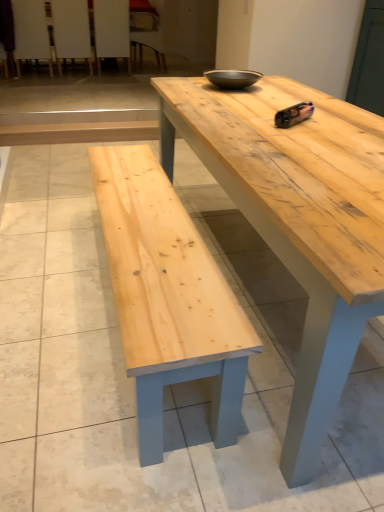
Find the location of a particular element. Image resolution: width=384 pixels, height=512 pixels. vacant space to the left of natural wood table at center is located at coordinates (52, 264).